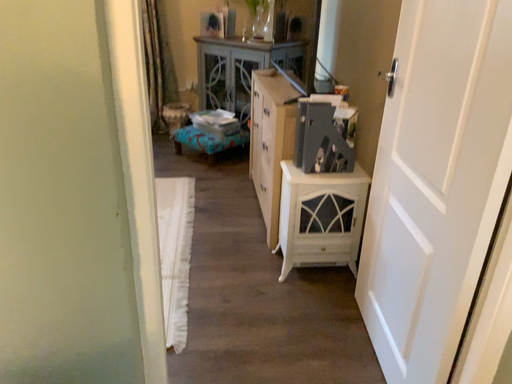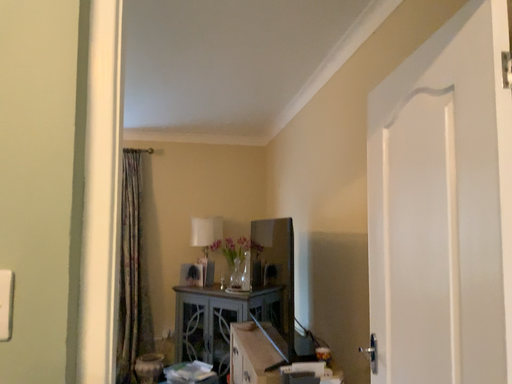
Question: How did the camera likely rotate when shooting the video?

Choices:
 (A) rotated upward
 (B) rotated downward

Answer: (A)